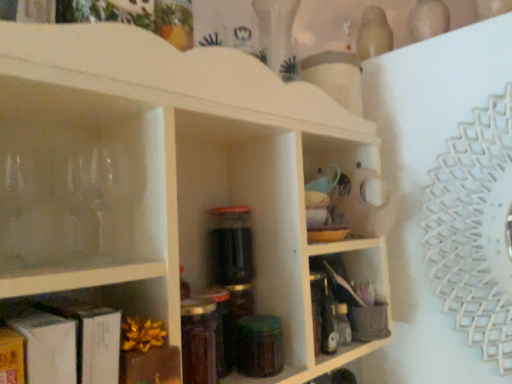
Question: Is translucent glass jar at center, the 1th bottle when ordered from left to right, oriented away from translucent plastic bottle at center-right, positioned as the 2th bottle in left-to-right order?

Choices:
 (A) yes
 (B) no

Answer: (B)

Question: Considering the relative sizes of translucent glass jar at center, marked as the second bottle in a back-to-front arrangement, and translucent plastic bottle at center-right, placed as the 1th bottle when sorted from right to left, in the image provided, is translucent glass jar at center, marked as the second bottle in a back-to-front arrangement, wider than translucent plastic bottle at center-right, placed as the 1th bottle when sorted from right to left,?

Choices:
 (A) yes
 (B) no

Answer: (A)

Question: From the image's perspective, is translucent glass jar at center, marked as the first bottle in a front-to-back arrangement, below translucent plastic bottle at center-right, the 2th bottle viewed from the front?

Choices:
 (A) no
 (B) yes

Answer: (A)

Question: Is translucent glass jar at center, marked as the first bottle in a front-to-back arrangement, outside translucent plastic bottle at center-right, placed as the 1th bottle when sorted from right to left?

Choices:
 (A) no
 (B) yes

Answer: (B)

Question: Is translucent glass jar at center, the 1th bottle when ordered from left to right, behind translucent plastic bottle at center-right, positioned as the 2th bottle in left-to-right order?

Choices:
 (A) no
 (B) yes

Answer: (A)

Question: Choose the correct answer: Is white matte shelf at center, placed as the second shelf when sorted from front to back, inside matte brown book at lower left, acting as the first shelf starting from the front, or outside it?

Choices:
 (A) outside
 (B) inside

Answer: (A)

Question: Is white matte shelf at center, placed as the second shelf when sorted from front to back, to the left or to the right of matte brown book at lower left, the third shelf viewed from the back, in the image?

Choices:
 (A) left
 (B) right

Answer: (B)

Question: Looking at the image, does white matte shelf at center, which is the second shelf from back to front, seem bigger or smaller compared to matte brown book at lower left, the third shelf viewed from the back?

Choices:
 (A) big
 (B) small

Answer: (A)

Question: Is white matte shelf at center, which is the second shelf from back to front, in front of or behind matte brown book at lower left, the third shelf viewed from the back, in the image?

Choices:
 (A) behind
 (B) front

Answer: (A)

Question: From the image's perspective, is matte brown book at lower left, the third shelf viewed from the back, located above or below green glass jar at center?

Choices:
 (A) above
 (B) below

Answer: (A)

Question: Is matte brown book at lower left, acting as the first shelf starting from the front, taller or shorter than green glass jar at center?

Choices:
 (A) tall
 (B) short

Answer: (A)

Question: Considering the relative positions of matte brown book at lower left, acting as the first shelf starting from the front, and green glass jar at center in the image provided, is matte brown book at lower left, acting as the first shelf starting from the front, to the left or to the right of green glass jar at center?

Choices:
 (A) right
 (B) left

Answer: (B)

Question: Is matte brown book at lower left, the third shelf viewed from the back, bigger or smaller than green glass jar at center?

Choices:
 (A) big
 (B) small

Answer: (A)

Question: Is matte plastic container at lower right, which is the 3th shelf from front to back, wider or thinner than white matte shelf at center, which is the second shelf from back to front?

Choices:
 (A) wide
 (B) thin

Answer: (B)

Question: From the image's perspective, is matte plastic container at lower right, which is the 3th shelf from front to back, positioned above or below white matte shelf at center, placed as the second shelf when sorted from front to back?

Choices:
 (A) below
 (B) above

Answer: (A)